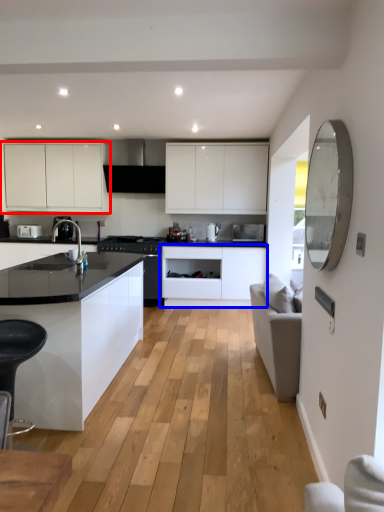
Question: Which object is closer to the camera taking this photo, cabinetry (highlighted by a red box) or cabinetry (highlighted by a blue box)?

Choices:
 (A) cabinetry
 (B) cabinetry

Answer: (B)